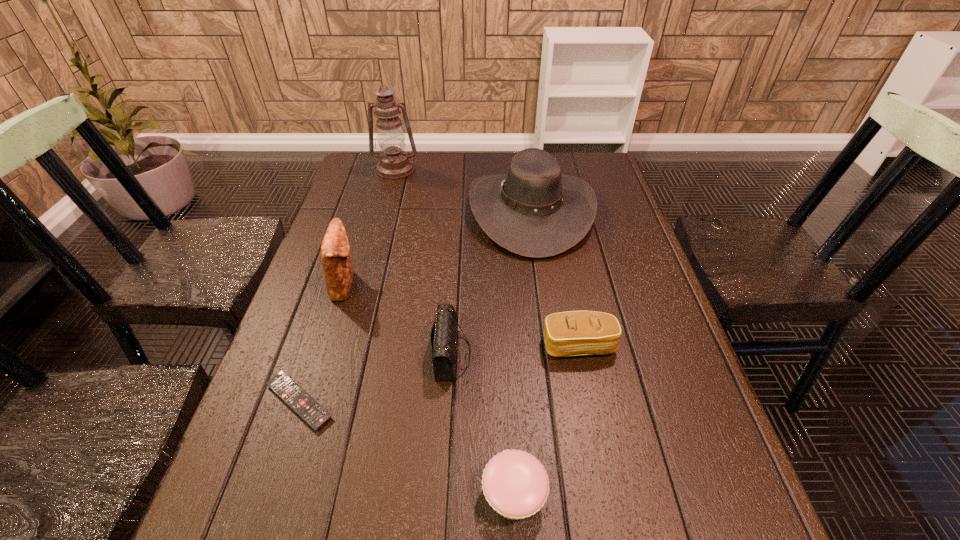
You are a GUI agent. You are given a task and a screenshot of the screen. Output one action in this format:
    pyautogui.click(x=<x>, y=<y>)
    Task: Click on the vacant region between the second clutch bag from left to right and the leftmost clutch bag
    The width and height of the screenshot is (960, 540).
    Given the screenshot: What is the action you would take?
    pyautogui.click(x=398, y=319)

This screenshot has width=960, height=540. In order to click on object identified as the fourth closest to the shortest object in this screenshot , I will do `click(572, 333)`.

Locate an element on the screen. the closest object relative to the oil lamp is located at coordinates (533, 211).

This screenshot has height=540, width=960. In order to click on clutch bag that can be found as the closest to the nearest object in this screenshot , I will do tap(443, 337).

The height and width of the screenshot is (540, 960). I want to click on clutch bag that stands as the second closest to the cowboy hat, so click(x=572, y=333).

Where is `free space that satisfies the following two spatial constraints: 1. on the open side of the fifth nearest object; 2. on the back side of the nearest object`? This screenshot has height=540, width=960. free space that satisfies the following two spatial constraints: 1. on the open side of the fifth nearest object; 2. on the back side of the nearest object is located at coordinates (279, 495).

The height and width of the screenshot is (540, 960). Find the location of `blank area in the image that satisfies the following two spatial constraints: 1. on the zipper side of the rightmost clutch bag; 2. on the front flap of the second clutch bag from left to right`. blank area in the image that satisfies the following two spatial constraints: 1. on the zipper side of the rightmost clutch bag; 2. on the front flap of the second clutch bag from left to right is located at coordinates tap(581, 355).

Image resolution: width=960 pixels, height=540 pixels. Find the location of `free space that satisfies the following two spatial constraints: 1. on the front flap of the second clutch bag from left to right; 2. on the back side of the sixth tallest object`. free space that satisfies the following two spatial constraints: 1. on the front flap of the second clutch bag from left to right; 2. on the back side of the sixth tallest object is located at coordinates (444, 495).

What are the coordinates of `vacant region that satisfies the following two spatial constraints: 1. on the back side of the nearest object; 2. on the open side of the tallest clutch bag` in the screenshot? It's located at (503, 284).

The image size is (960, 540). In order to click on vacant area that satisfies the following two spatial constraints: 1. on the zipper side of the rightmost clutch bag; 2. on the front flap of the second clutch bag from left to right in this screenshot , I will do `click(581, 355)`.